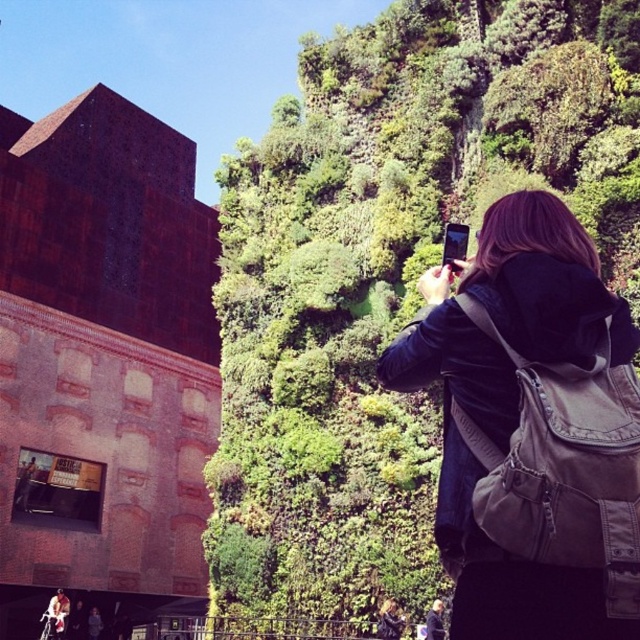
Between point (396, 177) and point (500, 196), which one is positioned behind?

Positioned behind is point (396, 177).

Is green leafy wall at upper center taller than dark brown leather jacket at upper right?

Correct, green leafy wall at upper center is much taller as dark brown leather jacket at upper right.

Who is more distant from viewer, [496,4] or [561,330]?

Point [496,4]

Where is `green leafy wall at upper center`? The height and width of the screenshot is (640, 640). green leafy wall at upper center is located at coordinates (388, 273).